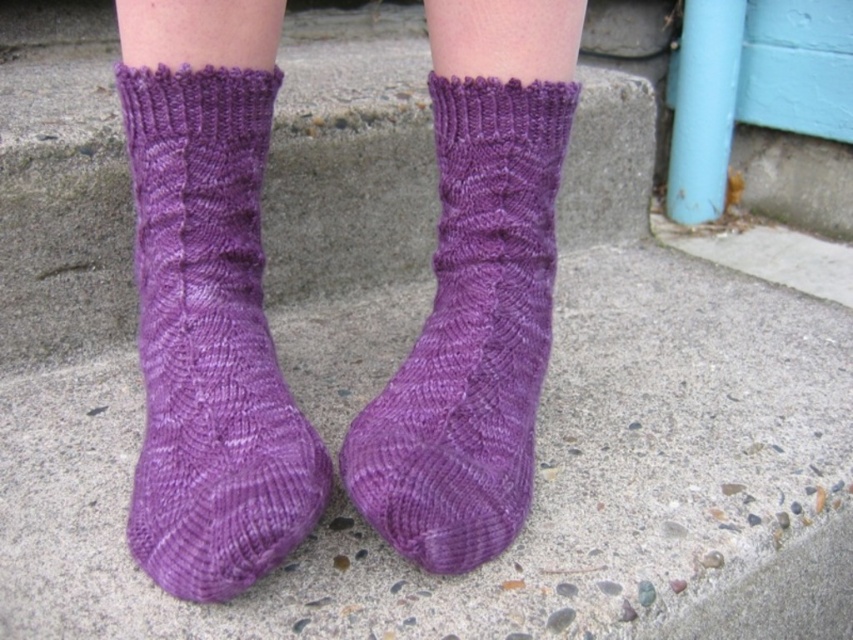
You are trying to decide which purple knitted sock to wear today. Both the purple knitted sock at left and the purple knitted sock at center are available. Based on their widths, which one would you choose if you want a wider sock?

The purple knitted sock at left might be wider than the purple knitted sock at center, so you should choose the purple knitted sock at left if you want a wider sock.

You are a tailor measuring the distance between two purple knitted socks. The purple knitted sock at left and the purple knitted sock at center are part of a display. If the minimum required space between socks for proper airflow is 8 inches, will the current spacing meet the requirement?

The purple knitted sock at left is 7.91 inches from the purple knitted sock at center, which is less than the required 8 inches. Therefore, the current spacing does not meet the airflow requirement.